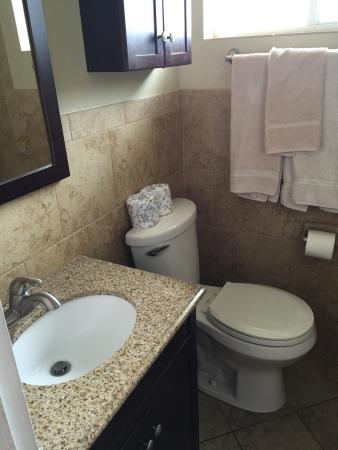
Locate an element on the screen. The width and height of the screenshot is (338, 450). floor tiles is located at coordinates (293, 431), (322, 421), (310, 403), (235, 421), (218, 425).